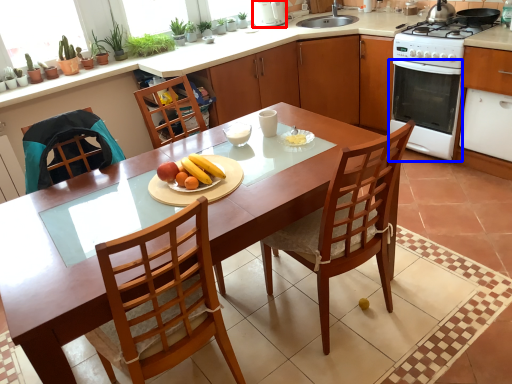
Question: Which object appears farthest to the camera in this image, kitchen appliance (highlighted by a red box) or oven (highlighted by a blue box)?

Choices:
 (A) kitchen appliance
 (B) oven

Answer: (A)